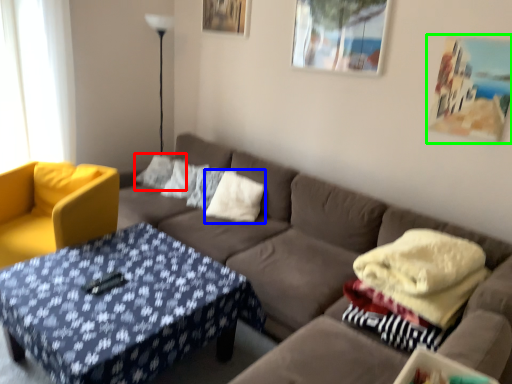
Question: Estimate the real-world distances between objects in this image. Which object is farther from pillow (highlighted by a red box), pillow (highlighted by a blue box) or picture frame (highlighted by a green box)?

Choices:
 (A) pillow
 (B) picture frame

Answer: (B)